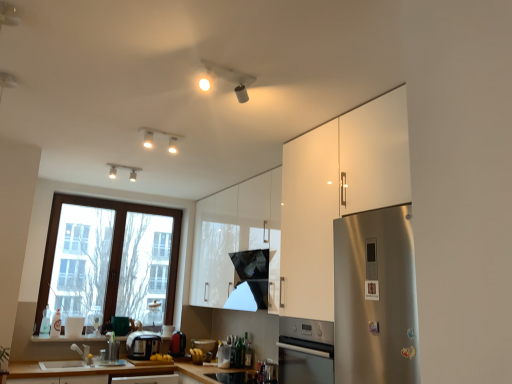
Question: Based on their positions, is translucent glass bottle at lower left, the first bottle from the left, located to the left or right of glossy black exhaust hood at center?

Choices:
 (A) left
 (B) right

Answer: (A)

Question: Considering the positions of translucent glass bottle at lower left, the fourth bottle positioned from the right, and glossy black exhaust hood at center in the image, is translucent glass bottle at lower left, the fourth bottle positioned from the right, taller or shorter than glossy black exhaust hood at center?

Choices:
 (A) short
 (B) tall

Answer: (A)

Question: Considering the real-world distances, which object is farthest from the glossy black exhaust hood at center?

Choices:
 (A) white glossy window sill at lower center
 (B) translucent plastic bottle at window, the 3th bottle from the right
 (C) green glass bottle at lower center, arranged as the 2th bottle when viewed from the right
 (D) satin silver toaster at center, the third appliance from the right
 (E) white glossy cabinet at upper center, the 2th cabinetry positioned from the front

Answer: (B)

Question: Which object is positioned farthest from the translucent plastic bottle at window, the 3th bottle from the right?

Choices:
 (A) white glossy cabinet at upper center, the 2th cabinetry positioned from the front
 (B) brown wooden window at left
 (C) white glossy cabinet at right, the first cabinetry when ordered from front to back
 (D) white glossy window sill at lower center
 (E) satin silver toaster at center, the third appliance from the right

Answer: (C)